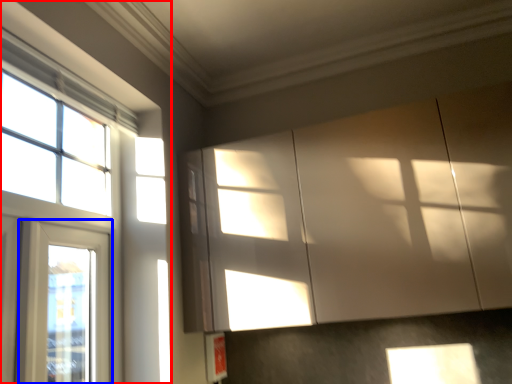
Question: Which object appears farthest to the camera in this image, window (highlighted by a red box) or window (highlighted by a blue box)?

Choices:
 (A) window
 (B) window

Answer: (B)